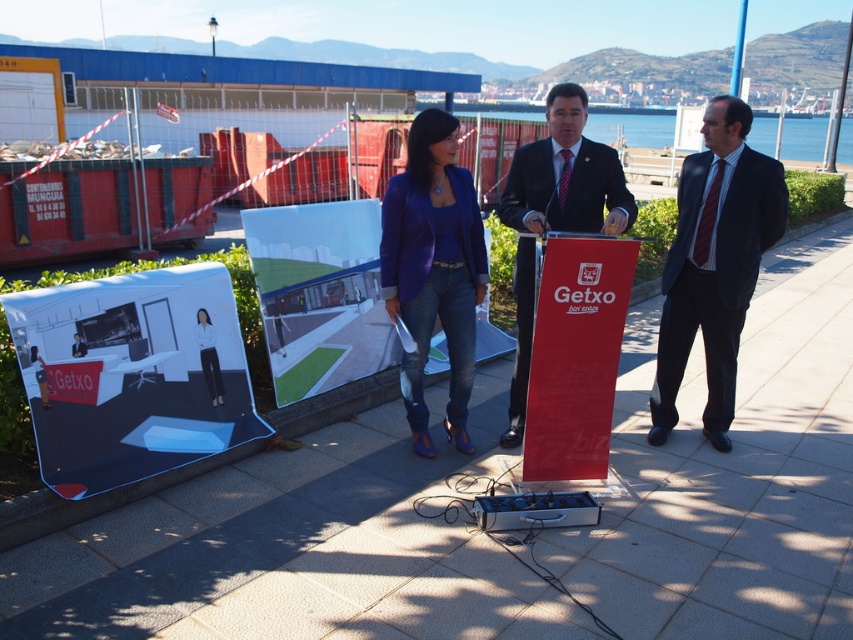
You are a photographer at the event and need to frame a photo that includes both the dark blue suit at center and the matte purple blazer at center. Which of the two clothing items is wider?

The dark blue suit at center is wider than the matte purple blazer at center according to the description provided.

Based on the photo, you are a photographer standing behind the matte concrete pavement at center. You want to take a photo of the matte black suit at center. Is the podium blocking your view?

The matte concrete pavement at center has a lesser height compared to matte black suit at center, so the podium is not blocking your view because the suit is taller than the pavement.

You are a photographer standing at the waterfront area. You want to take a photo of the dark blue suit at center without the matte concrete pavement at center appearing in the foreground. Is this possible?

The matte concrete pavement at center is closer to the viewer than the dark blue suit at center, so it will block the view of the dark blue suit at center. Therefore, it is not possible to take a photo of the dark blue suit at center without the matte concrete pavement at center appearing in the foreground.